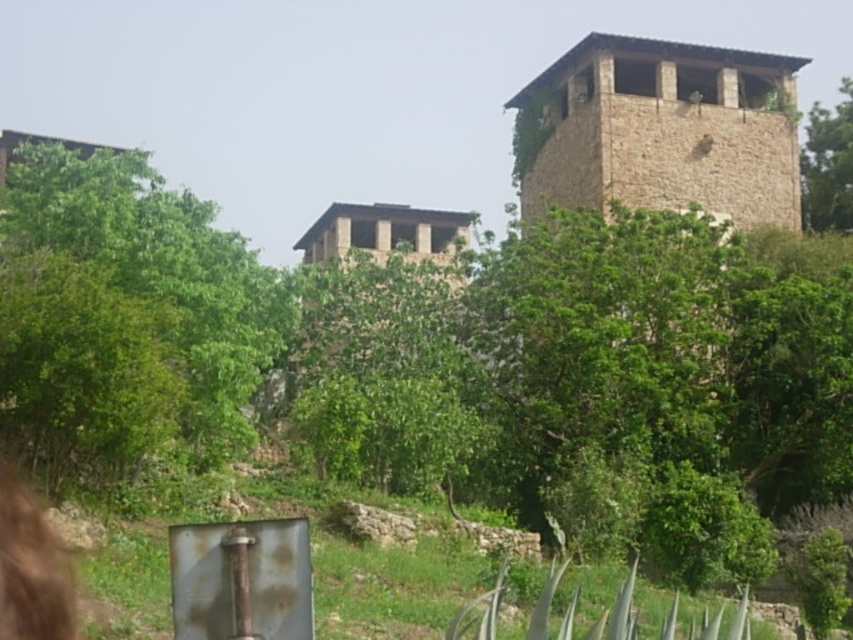
Between green leafy tree at left and green leafy tree at upper right, which one has more height?

Standing taller between the two is green leafy tree at upper right.

Is green leafy tree at left positioned in front of green leafy tree at upper right?

Yes, it is.

This screenshot has width=853, height=640. What are the coordinates of `green leafy tree at left` in the screenshot? It's located at (128, 316).

Which is in front, point (769, 212) or point (816, 163)?

Point (769, 212) is more forward.

Who is higher up, brown stone tower at upper right or green leafy tree at upper right?

Positioned higher is green leafy tree at upper right.

Which is in front, point (607, 179) or point (805, 168)?

Positioned in front is point (607, 179).

Where is `brown stone tower at upper right`? brown stone tower at upper right is located at coordinates (666, 131).

What are the coordinates of `green leafy tree at left` in the screenshot? It's located at (128, 316).

Where is `green leafy tree at left`? green leafy tree at left is located at coordinates (128, 316).